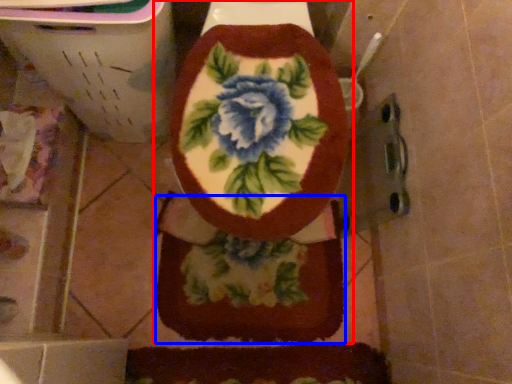
Question: Among these objects, which one is farthest to the camera, toilet (highlighted by a red box) or blanket (highlighted by a blue box)?

Choices:
 (A) toilet
 (B) blanket

Answer: (B)